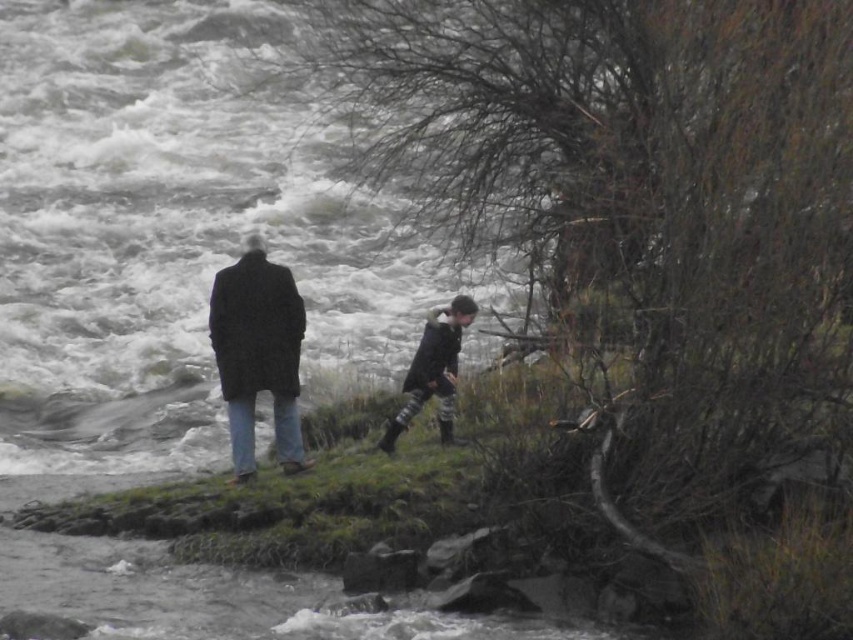
You are a photographer positioned at the riverbank and want to capture both the point at [1,449] and the point at [241,268] in your shot. Which point is closer to your camera lens?

Point at [1,449] is closer to the camera lens because it is further to the viewer than point at [241,268].

You are a hiker who wants to cross the river safely. You see the white frothy water at center and the dark gray textured coat at center. Which object is closer to you, and why might this affect your path?

The white frothy water at center is closer to you than the dark gray textured coat at center. This means the frothy water is in your immediate path, so you should avoid it due to its strong currents indicated by the froth.

You are a safety officer assessing the scene by the river. The two people are standing near the turbulent water. Given the distance between the dark wool coat at center and the dark gray textured coat at center, can a 3.5 feet wide safety barrier be placed between them to separate them from the river?

The distance between the dark wool coat at center and the dark gray textured coat at center is 4.17 feet. Since the safety barrier is 3.5 feet wide, it can be placed between them as the available space is sufficient.